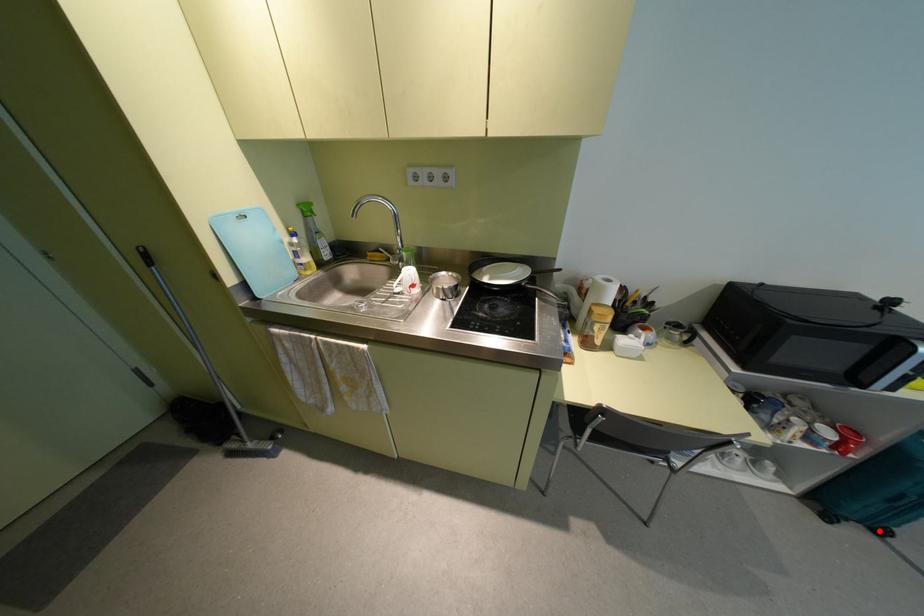
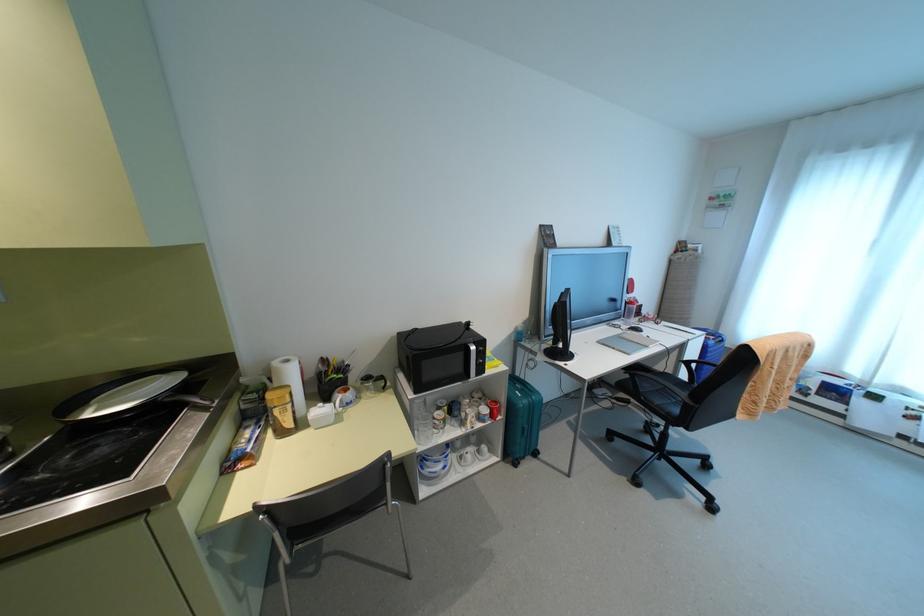
Question: I am providing you with two images of the same scene from different viewpoints. A red point is shown in image1. For the corresponding object point in image2, is it positioned nearer or farther from the camera?

Choices:
 (A) Nearer
 (B) Farther

Answer: (B)